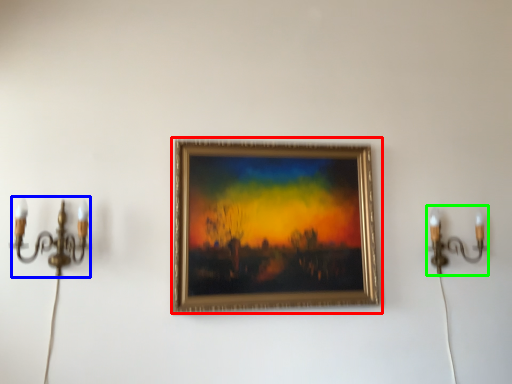
Question: Which is farther away from picture frame (highlighted by a red box)? candle holder (highlighted by a blue box) or candle holder (highlighted by a green box)?

Choices:
 (A) candle holder
 (B) candle holder

Answer: (A)